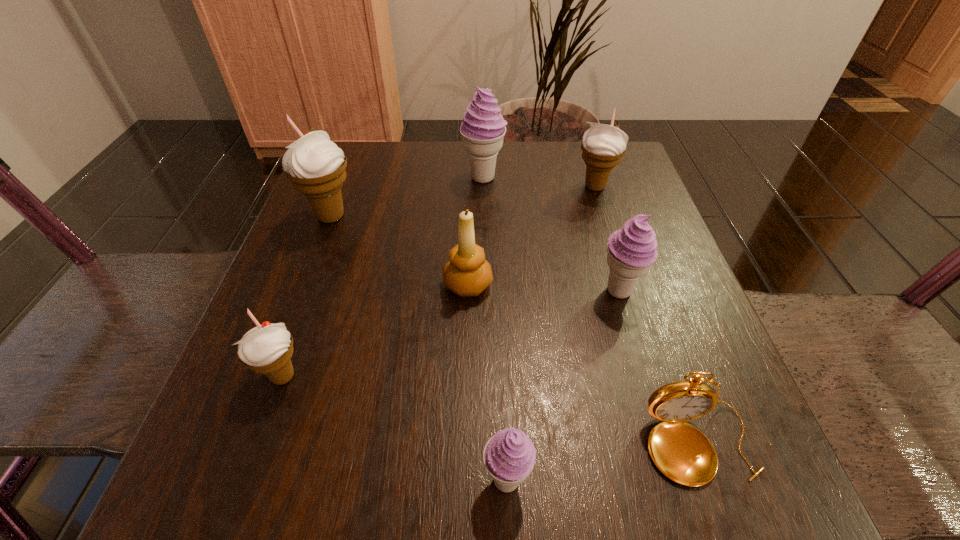
You are a GUI agent. You are given a task and a screenshot of the screen. Output one action in this format:
    pyautogui.click(x=<x>, y=<y>)
    Task: Click on the free area in between the pocket watch and the candle_holder
    Image resolution: width=960 pixels, height=540 pixels.
    Given the screenshot: What is the action you would take?
    pyautogui.click(x=584, y=364)

You are a GUI agent. You are given a task and a screenshot of the screen. Output one action in this format:
    pyautogui.click(x=<x>, y=<y>)
    Task: Click on the object that is the nearest to the pocket watch
    Image resolution: width=960 pixels, height=540 pixels.
    Given the screenshot: What is the action you would take?
    pyautogui.click(x=509, y=456)

Choose which object is the seventh nearest neighbor to the second biggest white icecream. Please provide its 2D coordinates. Your answer should be formatted as a tuple, i.e. [(x, y)], where the tuple contains the x and y coordinates of a point satisfying the conditions above.

[(267, 349)]

You are a GUI agent. You are given a task and a screenshot of the screen. Output one action in this format:
    pyautogui.click(x=<x>, y=<y>)
    Task: Click on the icecream that can be found as the fifth closest to the nearest icecream
    This screenshot has width=960, height=540.
    Given the screenshot: What is the action you would take?
    pyautogui.click(x=483, y=128)

The width and height of the screenshot is (960, 540). In order to click on the third closest icecream to the biggest purple icecream in this screenshot , I will do `click(631, 250)`.

The image size is (960, 540). I want to click on the second closest purple icecream relative to the second nearest purple icecream, so click(x=483, y=128).

Locate an element on the screen. Image resolution: width=960 pixels, height=540 pixels. the closest purple icecream to the rightmost purple icecream is located at coordinates (509, 456).

Point out which white icecream is positioned as the third nearest to the nearest icecream. Please provide its 2D coordinates. Your answer should be formatted as a tuple, i.e. [(x, y)], where the tuple contains the x and y coordinates of a point satisfying the conditions above.

[(603, 145)]

Identify the location of white icecream that is the second closest to the candle_holder. (267, 349).